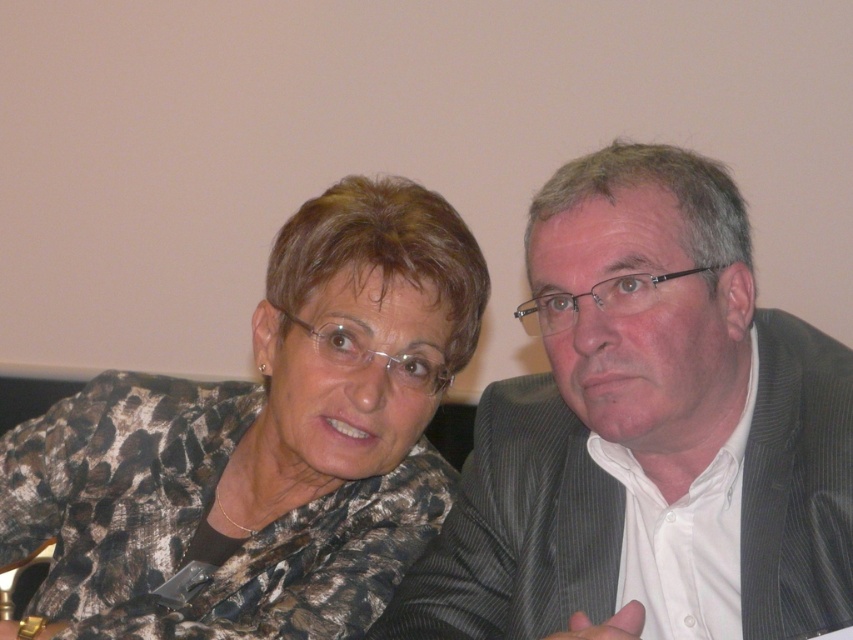
Question: Does gray striped suit at right come in front of printed fabric blouse at center?

Choices:
 (A) yes
 (B) no

Answer: (A)

Question: Which point is farther to the camera?

Choices:
 (A) printed fabric blouse at center
 (B) gray striped suit at right

Answer: (A)

Question: From the image, what is the correct spatial relationship of gray striped suit at right in relation to printed fabric blouse at center?

Choices:
 (A) below
 (B) above

Answer: (B)

Question: Among these points, which one is farthest from the camera?

Choices:
 (A) (503, 470)
 (B) (318, 531)

Answer: (A)

Question: Can you confirm if gray striped suit at right is wider than printed fabric blouse at center?

Choices:
 (A) yes
 (B) no

Answer: (B)

Question: Among these points, which one is farthest from the camera?

Choices:
 (A) (283, 483)
 (B) (550, 330)

Answer: (A)